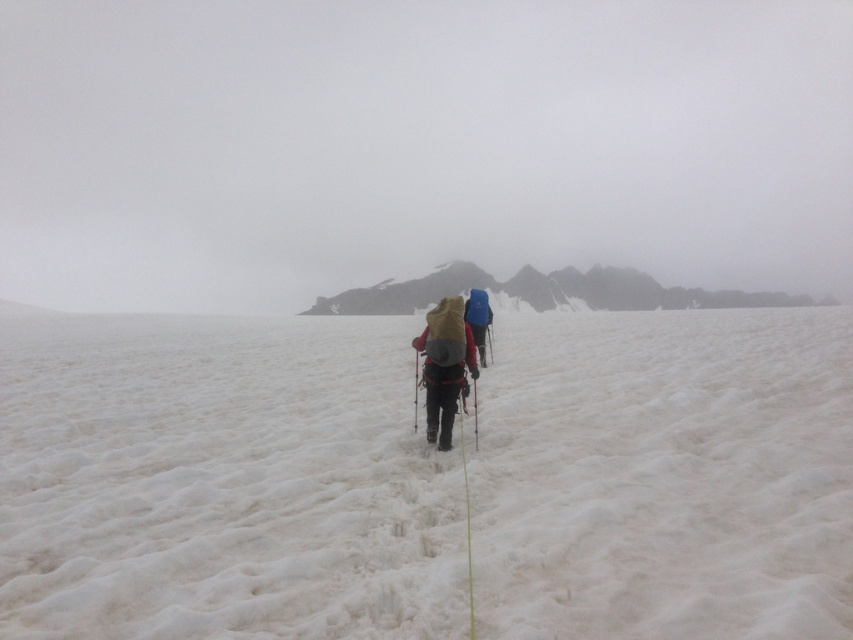
Does rugged stone mountain at center come in front of blue fabric backpack at center?

No, it is not.

Is rugged stone mountain at center bigger than blue fabric backpack at center?

Indeed, rugged stone mountain at center has a larger size compared to blue fabric backpack at center.

Where is `rugged stone mountain at center`? The image size is (853, 640). rugged stone mountain at center is located at coordinates (547, 291).

Where is `rugged stone mountain at center`? Image resolution: width=853 pixels, height=640 pixels. rugged stone mountain at center is located at coordinates (547, 291).

Does matte yellow backpack at center have a greater width compared to blue fabric backpack at center?

Indeed, matte yellow backpack at center has a greater width compared to blue fabric backpack at center.

Who is positioned more to the left, matte yellow backpack at center or blue fabric backpack at center?

matte yellow backpack at center

Is point (432, 435) positioned after point (486, 312)?

No.

You are a GUI agent. You are given a task and a screenshot of the screen. Output one action in this format:
    pyautogui.click(x=<x>, y=<y>)
    Task: Click on the matte yellow backpack at center
    The image size is (853, 640).
    Given the screenshot: What is the action you would take?
    pyautogui.click(x=444, y=365)

Which is more to the left, white fluffy snow at center or matte yellow backpack at center?

white fluffy snow at center is more to the left.

Is white fluffy snow at center wider than matte yellow backpack at center?

Yes, white fluffy snow at center is wider than matte yellow backpack at center.

Identify the location of white fluffy snow at center. The width and height of the screenshot is (853, 640). (221, 483).